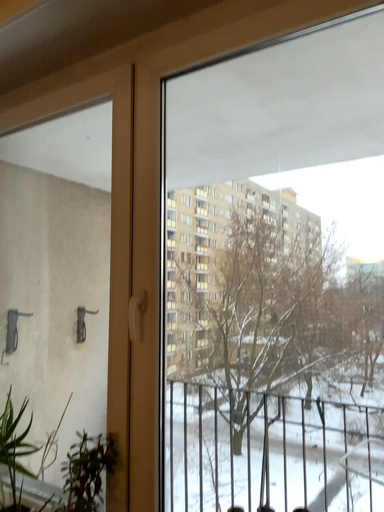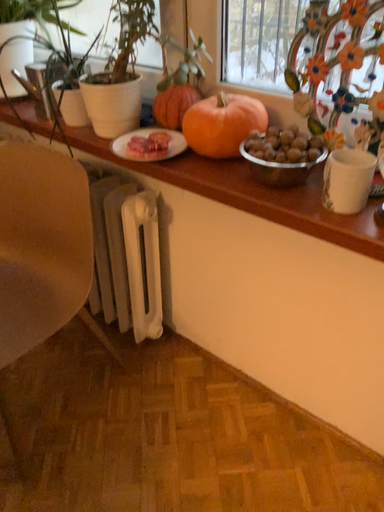
Question: Which way did the camera rotate in the video?

Choices:
 (A) rotated upward
 (B) rotated downward

Answer: (B)